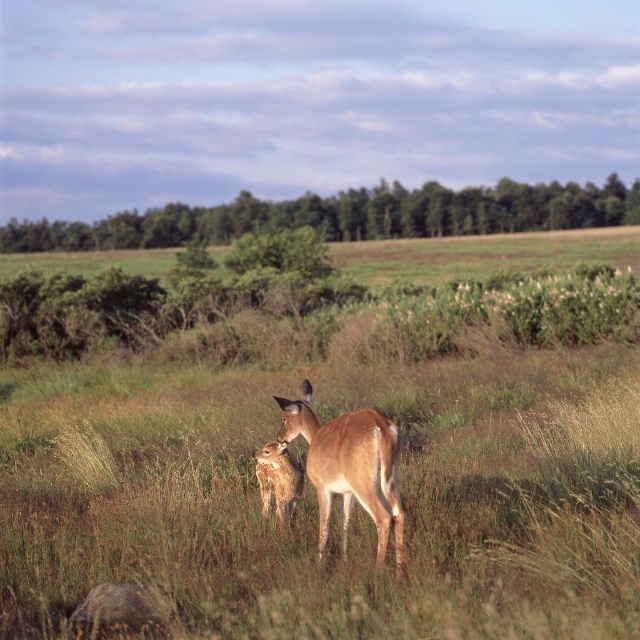
Question: Does green grassy at center appear on the left side of brown fur antelope at center?

Choices:
 (A) yes
 (B) no

Answer: (A)

Question: Where is green grassy at center located in relation to brown fur antelope at center in the image?

Choices:
 (A) left
 (B) right

Answer: (A)

Question: Where is green grassy at center located in relation to brown matte/deer at center in the image?

Choices:
 (A) left
 (B) right

Answer: (A)

Question: Which point is farther from the camera taking this photo?

Choices:
 (A) (275, 493)
 (B) (387, 436)
 (C) (596, 349)

Answer: (C)

Question: Among these points, which one is farthest from the camera?

Choices:
 (A) (595, 476)
 (B) (253, 452)
 (C) (340, 493)

Answer: (B)

Question: Among these objects, which one is farthest from the camera?

Choices:
 (A) brown fur antelope at center
 (B) brown matte/deer at center
 (C) green grassy at center

Answer: (A)